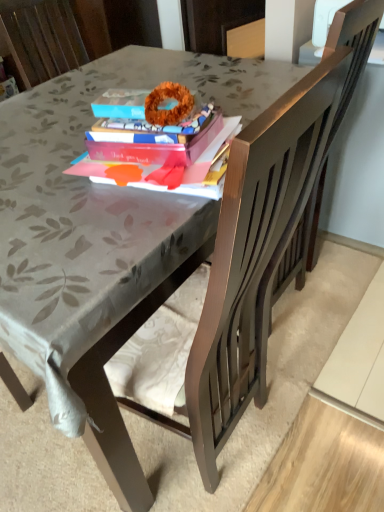
Question: Is point (379, 20) closer or farther from the camera than point (130, 135)?

Choices:
 (A) farther
 (B) closer

Answer: (A)

Question: In the image, is dark brown wood swivel chair at right on the left side or the right side of matte pink book at center?

Choices:
 (A) left
 (B) right

Answer: (B)

Question: Is dark brown wood swivel chair at right spatially inside matte pink book at center, or outside of it?

Choices:
 (A) outside
 (B) inside

Answer: (A)

Question: Is matte pink book at center to the left or to the right of dark brown wood swivel chair at right in the image?

Choices:
 (A) left
 (B) right

Answer: (A)

Question: From the image's perspective, is matte pink book at center positioned above or below dark brown wood swivel chair at right?

Choices:
 (A) above
 (B) below

Answer: (B)

Question: Considering the positions of point (153, 89) and point (322, 169), is point (153, 89) closer or farther from the camera than point (322, 169)?

Choices:
 (A) closer
 (B) farther

Answer: (A)

Question: Is matte pink book at center inside or outside of dark brown wood swivel chair at right?

Choices:
 (A) outside
 (B) inside

Answer: (A)